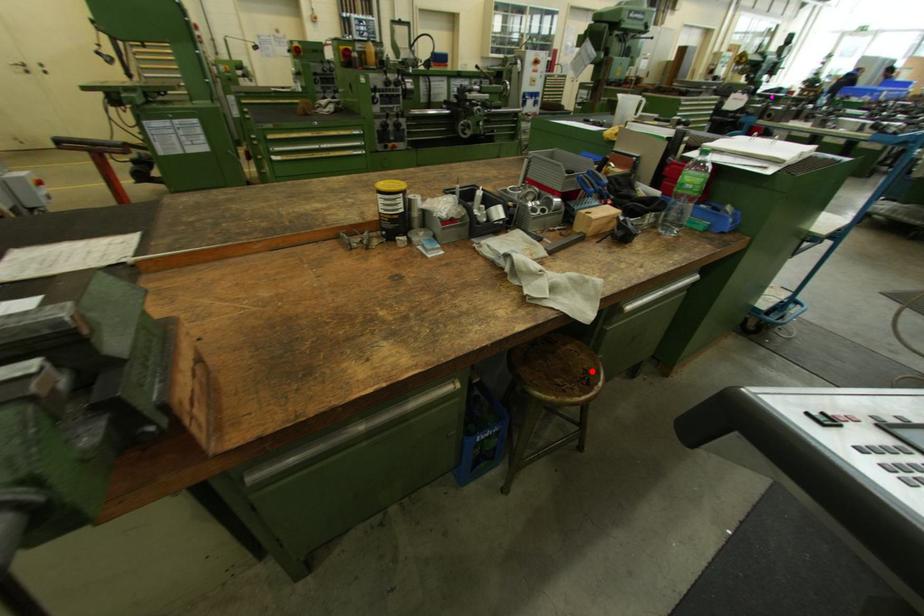
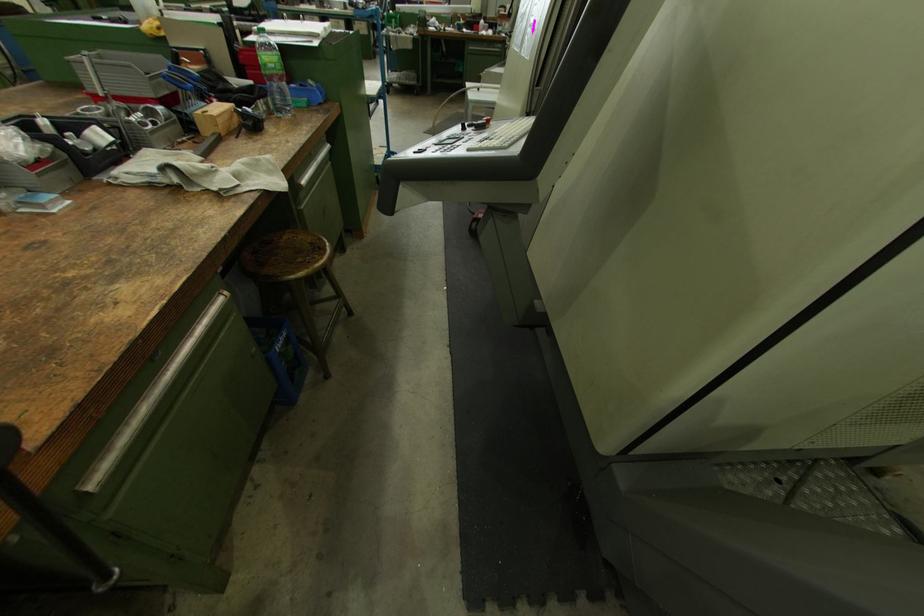
Question: I am providing you with two images of the same scene from different viewpoints. A red point is shown in image1. For the corresponding object point in image2, is it positioned nearer or farther from the camera?

Choices:
 (A) Nearer
 (B) Farther

Answer: (A)